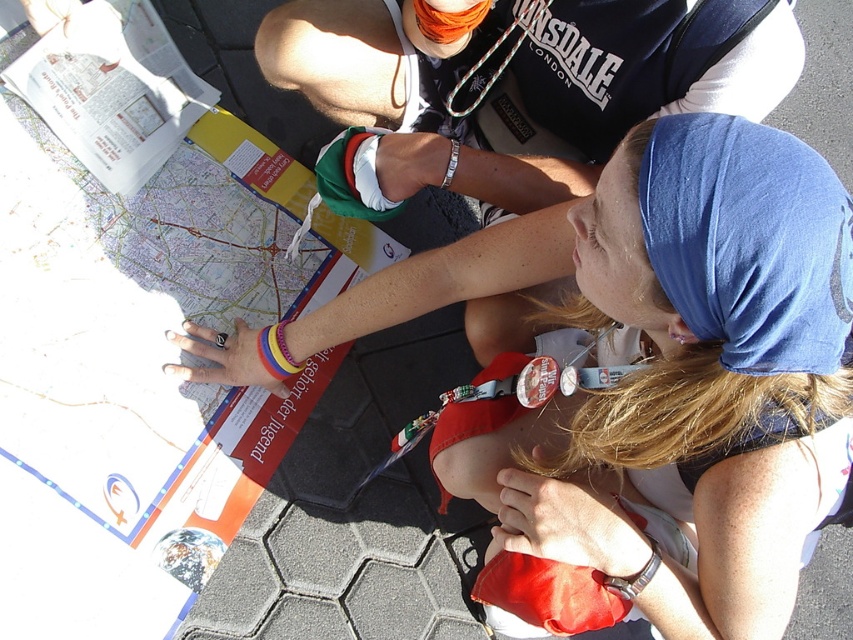
Question: Can you confirm if white matte map at center is positioned below dark blue fabric shirt at upper center?

Choices:
 (A) yes
 (B) no

Answer: (A)

Question: Does white matte map at center appear on the right side of dark blue fabric shirt at upper center?

Choices:
 (A) yes
 (B) no

Answer: (A)

Question: Does white matte map at center have a lesser width compared to dark blue fabric shirt at upper center?

Choices:
 (A) no
 (B) yes

Answer: (A)